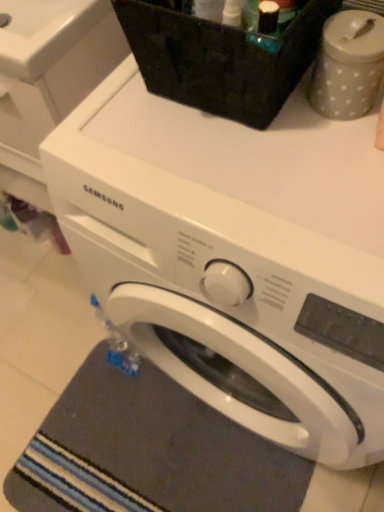
Question: Is gray dotted container at upper right in front of white matte washing machine at upper center, which appears as the 1th washing machine when viewed from the left?

Choices:
 (A) no
 (B) yes

Answer: (B)

Question: Is gray dotted container at upper right placed right next to white matte washing machine at upper center, which is counted as the second washing machine, starting from the right?

Choices:
 (A) no
 (B) yes

Answer: (A)

Question: From the image's perspective, would you say gray dotted container at upper right is shown under white matte washing machine at upper center, which is counted as the second washing machine, starting from the right?

Choices:
 (A) no
 (B) yes

Answer: (B)

Question: Considering the relative sizes of gray dotted container at upper right and white matte washing machine at upper center, which appears as the 1th washing machine when viewed from the left, in the image provided, is gray dotted container at upper right bigger than white matte washing machine at upper center, which appears as the 1th washing machine when viewed from the left,?

Choices:
 (A) yes
 (B) no

Answer: (B)

Question: Is gray dotted container at upper right further to the viewer compared to white matte washing machine at upper center, which is counted as the second washing machine, starting from the right?

Choices:
 (A) yes
 (B) no

Answer: (B)

Question: From a real-world perspective, is gray dotted container at upper right located higher than white matte washing machine at upper center, which appears as the 1th washing machine when viewed from the left?

Choices:
 (A) no
 (B) yes

Answer: (B)

Question: Is dark gray textured bath mat at lower left positioned behind gray dotted container at upper right?

Choices:
 (A) yes
 (B) no

Answer: (A)

Question: From the image's perspective, is dark gray textured bath mat at lower left located beneath gray dotted container at upper right?

Choices:
 (A) no
 (B) yes

Answer: (B)

Question: Is dark gray textured bath mat at lower left to the right of gray dotted container at upper right from the viewer's perspective?

Choices:
 (A) yes
 (B) no

Answer: (B)

Question: Does dark gray textured bath mat at lower left turn towards gray dotted container at upper right?

Choices:
 (A) no
 (B) yes

Answer: (A)

Question: Does dark gray textured bath mat at lower left have a greater height compared to gray dotted container at upper right?

Choices:
 (A) no
 (B) yes

Answer: (A)

Question: Can you confirm if dark gray textured bath mat at lower left is wider than gray dotted container at upper right?

Choices:
 (A) no
 (B) yes

Answer: (B)

Question: Does white glossy sink at upper left have a larger size compared to dark gray textured bath mat at lower left?

Choices:
 (A) no
 (B) yes

Answer: (B)